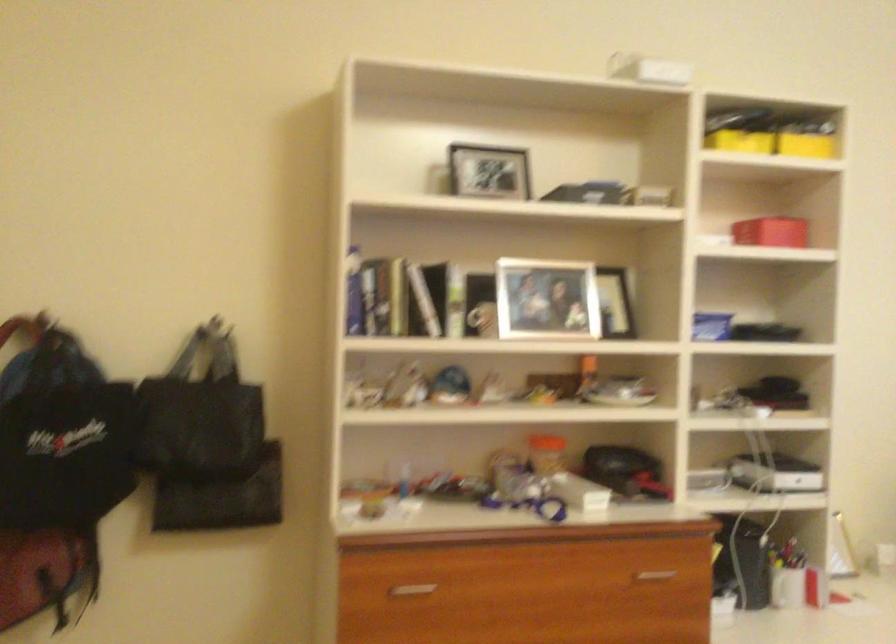
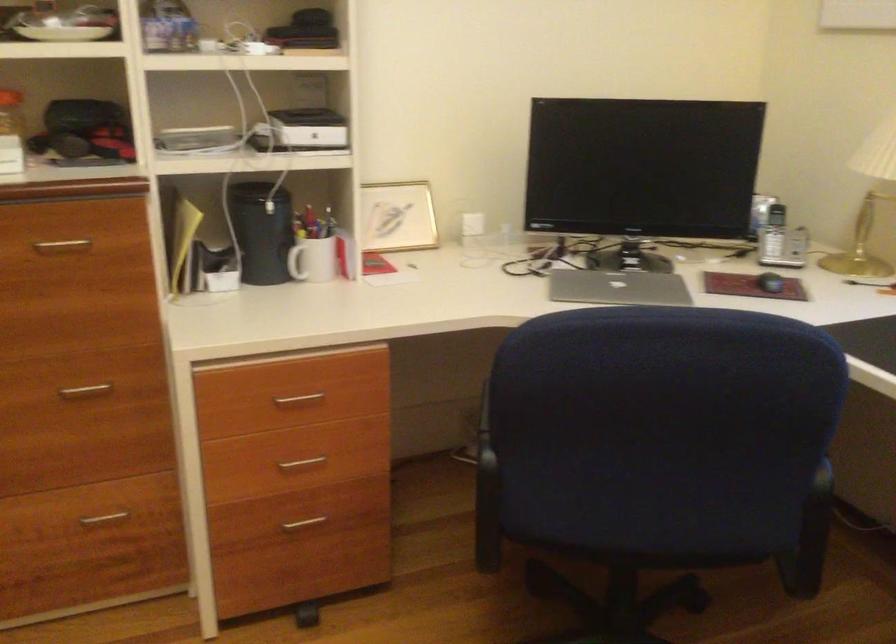
Question: Which direction would the cameraman need to move to produce the second image? Reply with the corresponding letter.

Choices:
 (A) Left
 (B) Right
 (C) Forward
 (D) Backward

Answer: (B)